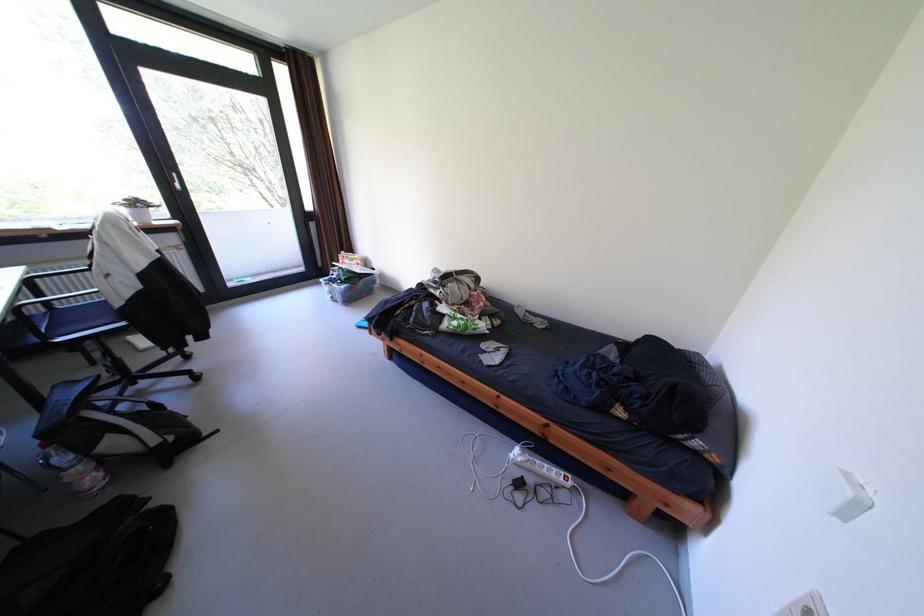
Where is `clear plastic bin`? The width and height of the screenshot is (924, 616). clear plastic bin is located at coordinates (348, 283).